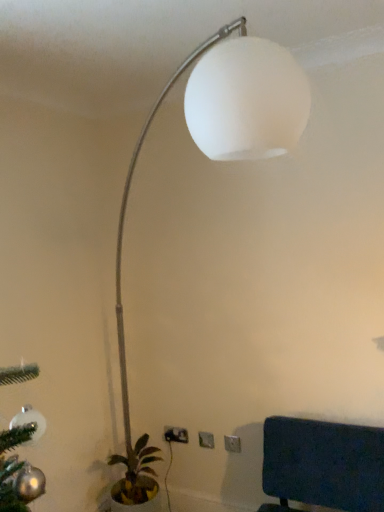
Question: From the image's perspective, is green leafy plant in pot at lower left located above white plastic electric outlet at lower center, which is the first electric outlet in right-to-left order?

Choices:
 (A) no
 (B) yes

Answer: (A)

Question: From a real-world perspective, is green leafy plant in pot at lower left under white plastic electric outlet at lower center, which is counted as the 1th electric outlet, starting from the front?

Choices:
 (A) yes
 (B) no

Answer: (A)

Question: Considering the relative sizes of green leafy plant in pot at lower left and white plastic electric outlet at lower center, arranged as the third electric outlet when viewed from the back, in the image provided, is green leafy plant in pot at lower left wider than white plastic electric outlet at lower center, arranged as the third electric outlet when viewed from the back,?

Choices:
 (A) yes
 (B) no

Answer: (A)

Question: Considering the relative positions of green leafy plant in pot at lower left and white plastic electric outlet at lower center, arranged as the third electric outlet when viewed from the back, in the image provided, is green leafy plant in pot at lower left to the right of white plastic electric outlet at lower center, arranged as the third electric outlet when viewed from the back, from the viewer's perspective?

Choices:
 (A) yes
 (B) no

Answer: (B)

Question: Is green leafy plant in pot at lower left closer to camera compared to white plastic electric outlet at lower center, which is the first electric outlet in right-to-left order?

Choices:
 (A) yes
 (B) no

Answer: (A)

Question: Is white plastic electric outlet at lower center, arranged as the third electric outlet when viewed from the back, at the back of green leafy plant in pot at lower left?

Choices:
 (A) no
 (B) yes

Answer: (A)

Question: From a real-world perspective, is white matte lamp at upper center below green leafy plant in pot at lower left?

Choices:
 (A) yes
 (B) no

Answer: (B)

Question: From the image's perspective, is white matte lamp at upper center above green leafy plant in pot at lower left?

Choices:
 (A) no
 (B) yes

Answer: (B)

Question: Considering the relative positions of white matte lamp at upper center and green leafy plant in pot at lower left in the image provided, is white matte lamp at upper center to the right of green leafy plant in pot at lower left from the viewer's perspective?

Choices:
 (A) yes
 (B) no

Answer: (A)

Question: Are white matte lamp at upper center and green leafy plant in pot at lower left located far from each other?

Choices:
 (A) no
 (B) yes

Answer: (A)

Question: Can you confirm if white matte lamp at upper center is wider than green leafy plant in pot at lower left?

Choices:
 (A) no
 (B) yes

Answer: (B)

Question: Is white matte lamp at upper center shorter than green leafy plant in pot at lower left?

Choices:
 (A) no
 (B) yes

Answer: (A)

Question: Can you confirm if green leafy plant in pot at lower left is shorter than white plastic electric outlet at lower center, the 2th electric outlet when ordered from front to back?

Choices:
 (A) no
 (B) yes

Answer: (A)